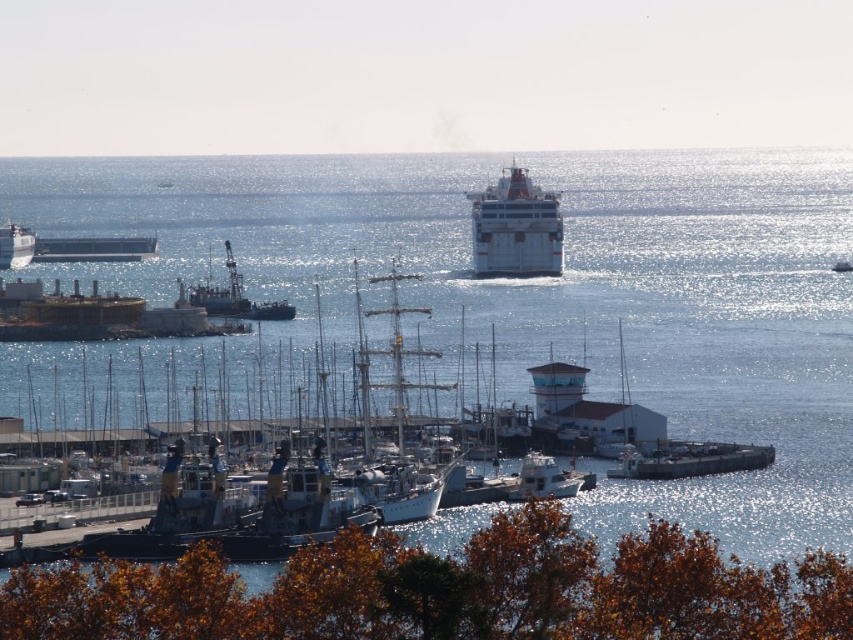
Question: Which of the following is the closest to the observer?

Choices:
 (A) white matte cruise ship at center
 (B) metallic gray ship at center
 (C) white matte ship at left
 (D) metallic gray barge at center

Answer: (D)

Question: Is white matte cruise ship at center below white matte ship at left?

Choices:
 (A) yes
 (B) no

Answer: (B)

Question: Based on their relative distances, which object is farther from the metallic gray ship at center?

Choices:
 (A) white matte cruise ship at center
 (B) metallic gray barge at center
 (C) white matte ship at left

Answer: (B)

Question: Can you confirm if metallic gray ship at center is positioned to the right of white matte ship at left?

Choices:
 (A) no
 (B) yes

Answer: (B)

Question: In this image, where is metallic gray barge at center located relative to white matte ship at left?

Choices:
 (A) right
 (B) left

Answer: (A)

Question: Which point is closer to the camera?

Choices:
 (A) metallic gray ship at center
 (B) white matte ship at left
 (C) white matte cruise ship at center
 (D) metallic gray barge at center

Answer: (D)